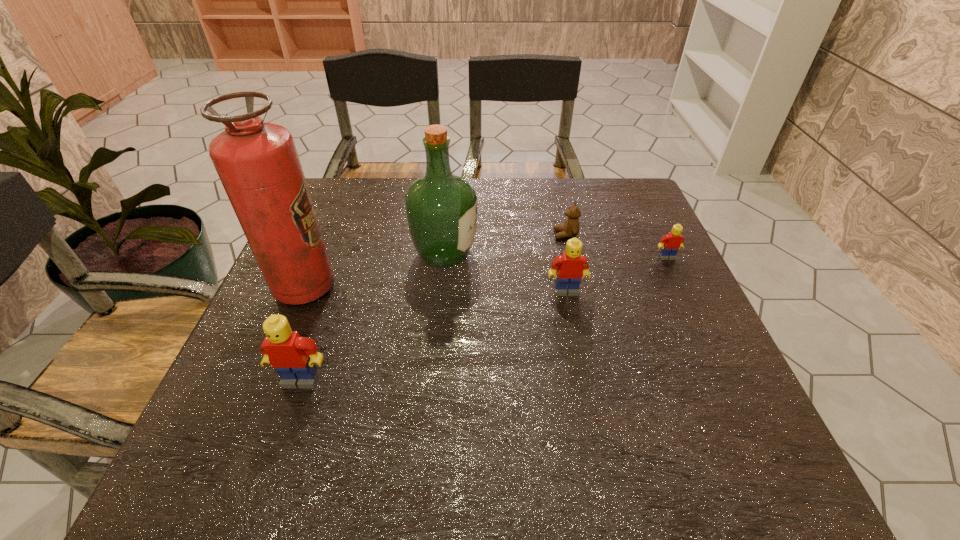
Find the location of a particular element. The height and width of the screenshot is (540, 960). object present at the right edge is located at coordinates (670, 243).

Find the location of a particular element. Image resolution: width=960 pixels, height=540 pixels. object situated at the near left corner is located at coordinates [293, 357].

Locate an element on the screen. free space at the far edge of the desktop is located at coordinates (535, 210).

The image size is (960, 540). In order to click on blank area at the near edge in this screenshot , I will do `click(521, 414)`.

Locate an element on the screen. The height and width of the screenshot is (540, 960). vacant space at the right edge of the desktop is located at coordinates (660, 301).

The width and height of the screenshot is (960, 540). Find the location of `free space at the far left corner of the desktop`. free space at the far left corner of the desktop is located at coordinates (339, 210).

The image size is (960, 540). In order to click on vacant area at the near left corner in this screenshot , I will do `click(256, 384)`.

Identify the location of free region at the far right corner. The height and width of the screenshot is (540, 960). (587, 180).

The width and height of the screenshot is (960, 540). Identify the location of vacant space at the near right corner. (740, 417).

The width and height of the screenshot is (960, 540). Find the location of `vacant area between the nearest Lego and the second shortest Lego`. vacant area between the nearest Lego and the second shortest Lego is located at coordinates (434, 335).